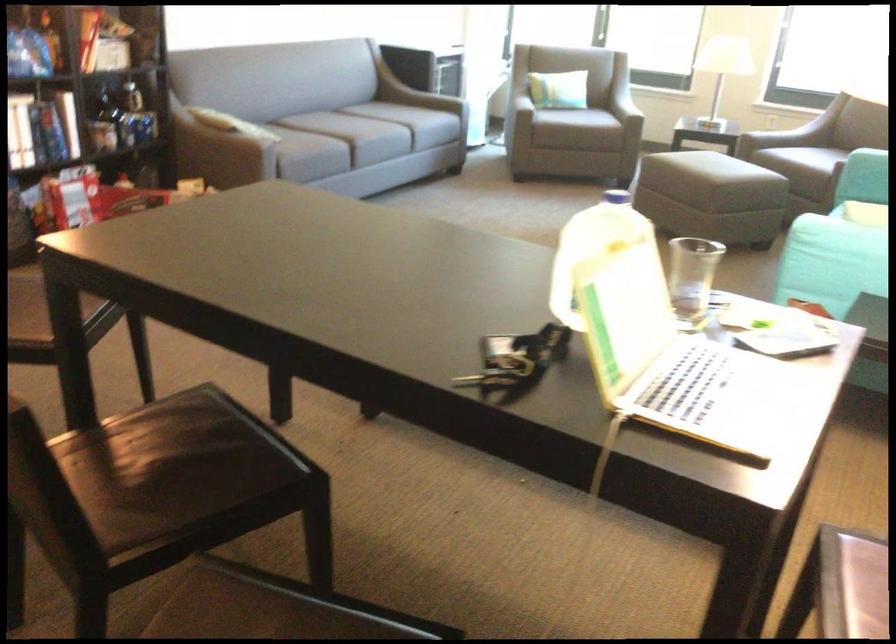
Find where to lift the drinking glass. Please return your answer as a coordinate pair (x, y).

(692, 277)